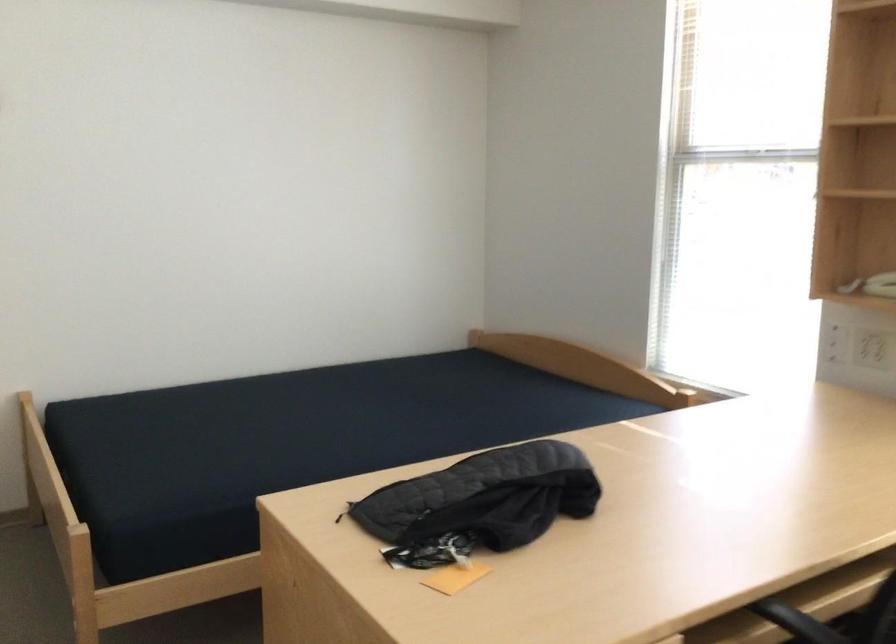
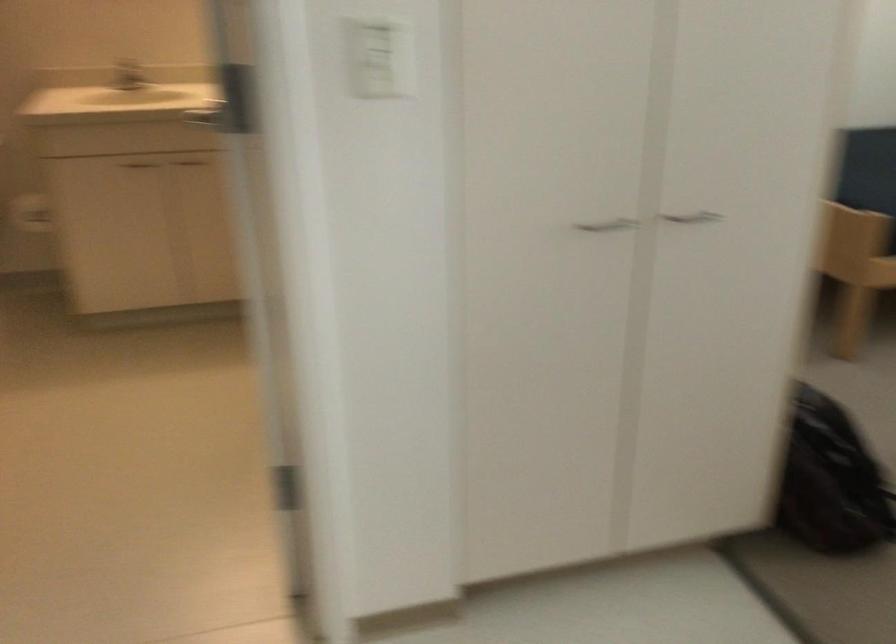
The images are taken continuously from a first-person perspective. In which direction are you moving?

The movement direction of the cameraman is left, backward.